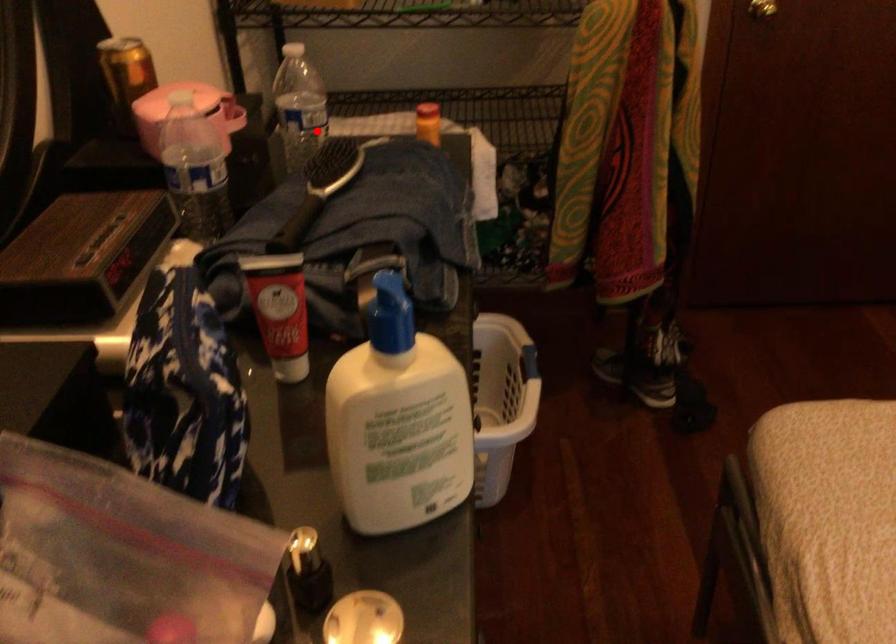
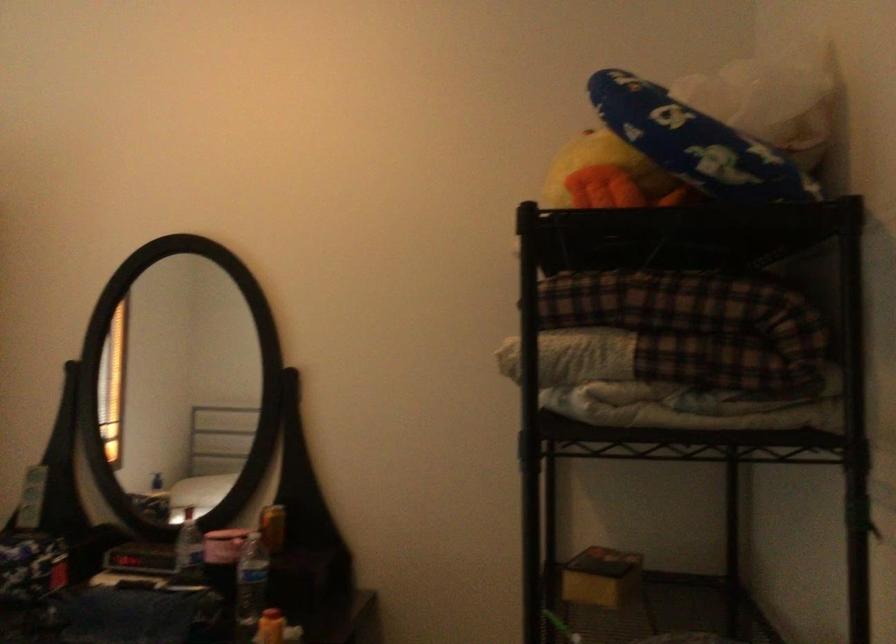
In the second image, find the point that corresponds to the highlighted location in the first image.

(250, 585)